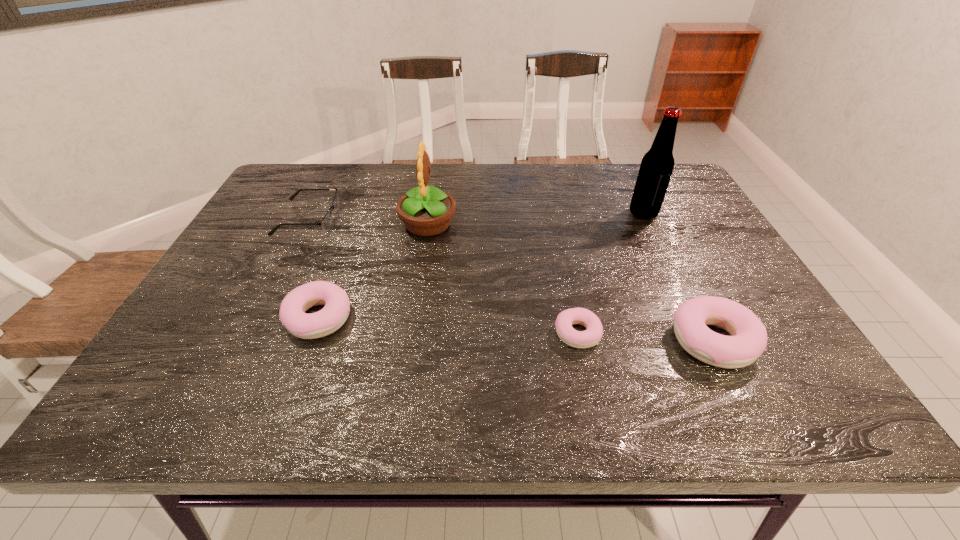
Where is `free region located on the back of the shortest pastry`? free region located on the back of the shortest pastry is located at coordinates (565, 279).

Identify the location of vacant space situated on the left of the rightmost pastry. Image resolution: width=960 pixels, height=540 pixels. (561, 341).

Where is `blank area located on the back of the tallest object`? blank area located on the back of the tallest object is located at coordinates (629, 185).

Where is `blank area located 0.100m on the front-facing side of the fifth tallest object`? This screenshot has height=540, width=960. blank area located 0.100m on the front-facing side of the fifth tallest object is located at coordinates (372, 218).

The width and height of the screenshot is (960, 540). I want to click on free space located 0.080m on the face of the fifth shortest object, so click(x=485, y=225).

Image resolution: width=960 pixels, height=540 pixels. Identify the location of object located at the far edge. (326, 222).

Image resolution: width=960 pixels, height=540 pixels. I want to click on object present at the left edge, so click(326, 222).

The height and width of the screenshot is (540, 960). Find the location of `pastry that is at the right edge`. pastry that is at the right edge is located at coordinates click(x=748, y=340).

Locate an element on the screen. beer bottle that is at the right edge is located at coordinates tap(656, 168).

At what (x,y) coordinates should I click in order to perform the action: click on object at the far left corner. Please return your answer as a coordinate pair (x, y). The height and width of the screenshot is (540, 960). Looking at the image, I should click on (326, 222).